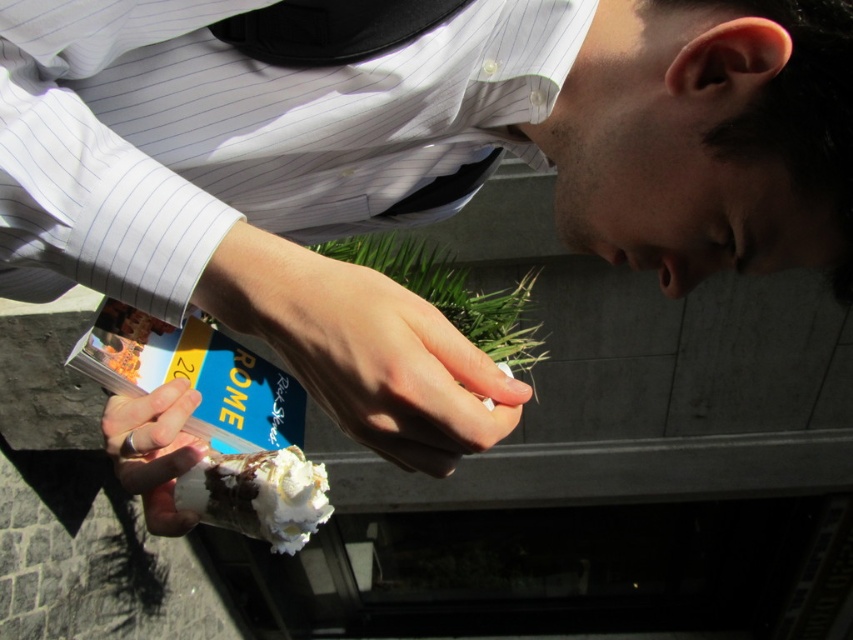
Does white striped dress shirt at center have a larger size compared to smooth skin hand at center?

Correct, white striped dress shirt at center is larger in size than smooth skin hand at center.

Is point (155, 211) positioned behind point (386, 449)?

No, (155, 211) is in front of (386, 449).

You are a GUI agent. You are given a task and a screenshot of the screen. Output one action in this format:
    pyautogui.click(x=<x>, y=<y>)
    Task: Click on the white striped dress shirt at center
    Image resolution: width=853 pixels, height=640 pixels.
    Given the screenshot: What is the action you would take?
    pyautogui.click(x=242, y=134)

Between smooth skin hand at center and whipped cream cone at center, which one has more height?

smooth skin hand at center is taller.

Is smooth skin hand at center smaller than whipped cream cone at center?

Actually, smooth skin hand at center might be larger than whipped cream cone at center.

Where is `smooth skin hand at center`? Image resolution: width=853 pixels, height=640 pixels. smooth skin hand at center is located at coordinates (378, 358).

Is green leafy grass at center behind white matte ice cream cone at center?

Yes, it is behind white matte ice cream cone at center.

Is green leafy grass at center bigger than white matte ice cream cone at center?

Correct, green leafy grass at center is larger in size than white matte ice cream cone at center.

Does point (412, 276) come behind point (173, 509)?

Yes, point (412, 276) is farther from viewer.

You are a GUI agent. You are given a task and a screenshot of the screen. Output one action in this format:
    pyautogui.click(x=<x>, y=<y>)
    Task: Click on the green leafy grass at center
    
    Given the screenshot: What is the action you would take?
    pyautogui.click(x=451, y=292)